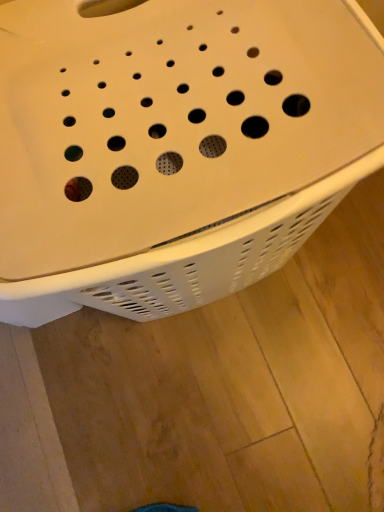
Describe the element at coordinates (174, 147) in the screenshot. I see `white plastic laundry basket at center` at that location.

At what (x,y) coordinates should I click in order to perform the action: click on white plastic laundry basket at center. Please return your answer as a coordinate pair (x, y). Looking at the image, I should click on (174, 147).

Measure the distance between white plastic laundry basket at center and camera.

white plastic laundry basket at center is 13.84 inches from camera.

You are a GUI agent. You are given a task and a screenshot of the screen. Output one action in this format:
    pyautogui.click(x=<x>, y=<y>)
    Task: Click on the white plastic laundry basket at center
    The image size is (384, 512).
    Given the screenshot: What is the action you would take?
    pyautogui.click(x=174, y=147)